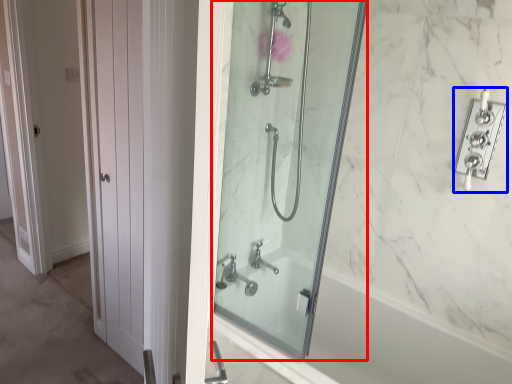
Question: Which object is closer to the camera taking this photo, mirror (highlighted by a red box) or lock (highlighted by a blue box)?

Choices:
 (A) mirror
 (B) lock

Answer: (A)